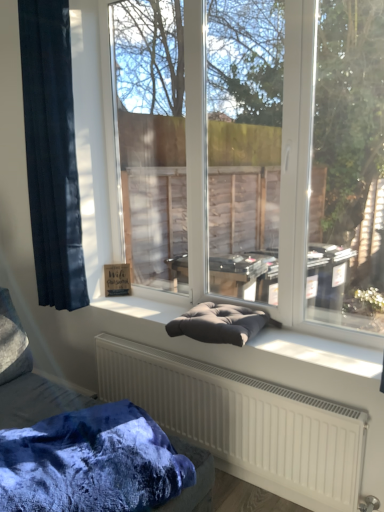
Question: From a real-world perspective, is dark gray fabric cushion at center physically located above or below velvety blue blanket at lower left?

Choices:
 (A) above
 (B) below

Answer: (A)

Question: Is dark gray fabric cushion at center bigger or smaller than velvety blue blanket at lower left?

Choices:
 (A) big
 (B) small

Answer: (B)

Question: Considering the real-world distances, which object is farthest from the dark gray fabric cushion at center?

Choices:
 (A) matte gray cushion at center
 (B) dark blue fabric at left
 (C) velvety blue blanket at lower left
 (D) dark gray cushion at center
 (E) velvet cushion at center

Answer: (A)

Question: Considering the real-world distances, which object is farthest from the dark gray cushion at center?

Choices:
 (A) velvet cushion at center
 (B) dark blue fabric at left
 (C) velvety blue blanket at lower left
 (D) dark gray fabric cushion at center
 (E) matte gray cushion at center

Answer: (E)